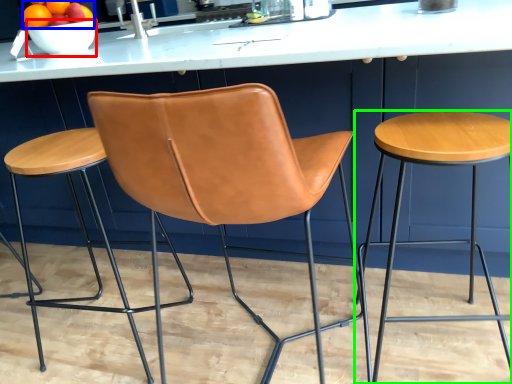
Question: Which object is the farthest from bowl (highlighted by a red box)? Choose among these: fruit (highlighted by a blue box) or stool (highlighted by a green box).

Choices:
 (A) fruit
 (B) stool

Answer: (B)